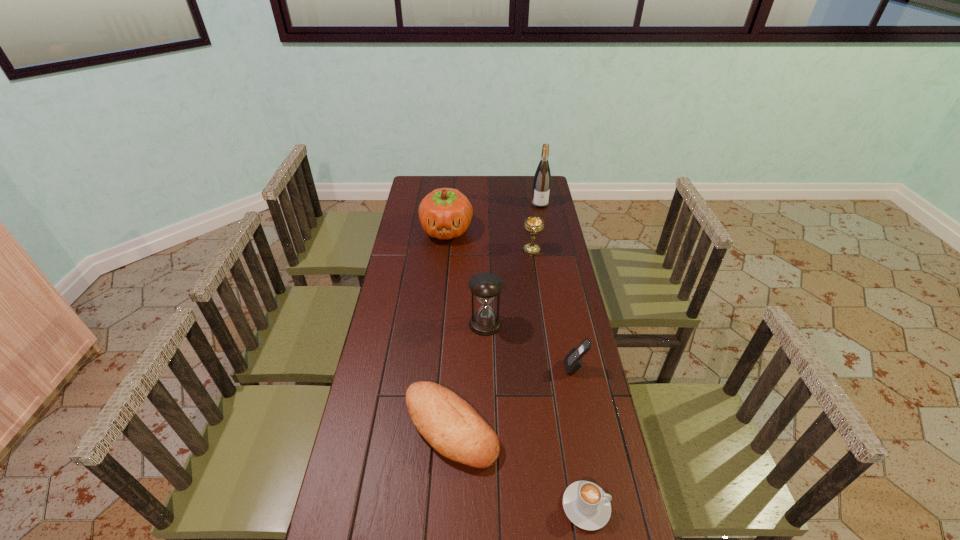
Locate an element on the screen. The width and height of the screenshot is (960, 540). vacant area that lies between the wine bottle and the cappuccino is located at coordinates (564, 355).

Identify the location of free point between the pumpkin and the cappuccino. (516, 368).

Find the location of a particular element. This screenshot has width=960, height=540. object that is the fifth closest to the cellular telephone is located at coordinates (445, 213).

Select which object is the fifth closest to the hourglass. Please provide its 2D coordinates. Your answer should be formatted as a tuple, i.e. [(x, y)], where the tuple contains the x and y coordinates of a point satisfying the conditions above.

[(587, 506)]

Locate an element on the screen. blank space that satisfies the following two spatial constraints: 1. on the back side of the fourth nearest object; 2. on the left side of the farthest object is located at coordinates (484, 204).

Locate an element on the screen. Image resolution: width=960 pixels, height=540 pixels. vacant space that satisfies the following two spatial constraints: 1. on the side of the chalice with the cute face; 2. on the right side of the pumpkin is located at coordinates (444, 250).